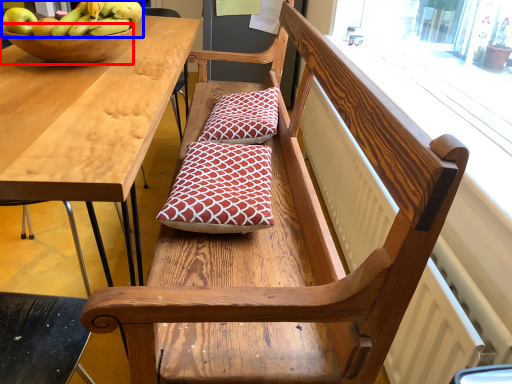
Question: Which object appears farthest to the camera in this image, bowl (highlighted by a red box) or banana (highlighted by a blue box)?

Choices:
 (A) bowl
 (B) banana

Answer: (A)